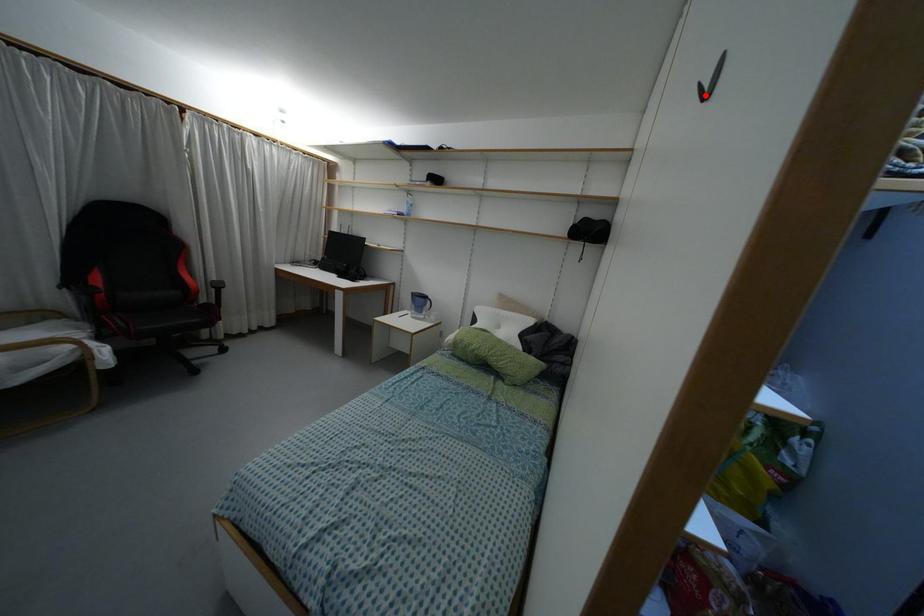
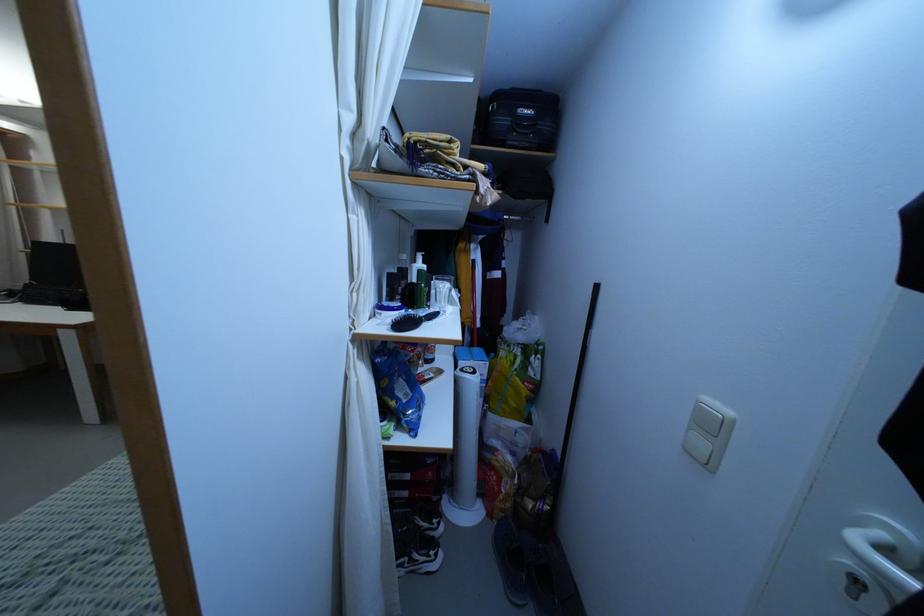
Question: I am providing you with two images of the same scene from different viewpoints. A red point is marked on the first image. Is the red point's position out of view in image 2?

Choices:
 (A) Yes
 (B) No

Answer: (A)